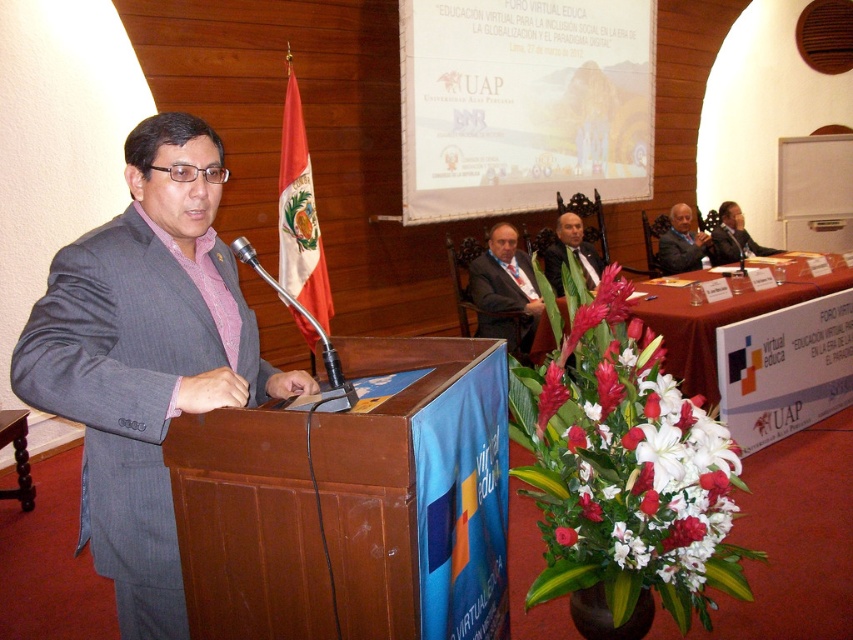
What is the location of the point with coordinates [299,216] in the image?

The point with coordinates [299,216] is located on the red fabric flag at upper left.

You are attending a formal event and see a gray pinstripe suit at left and a matte pink flower at center. Which object is positioned to the left of the other?

The gray pinstripe suit at left is positioned to the left of the matte pink flower at center.

You are organizing a charity event and need to decide which suit to choose between the gray pinstripe suit at left and the smooth black suit at right. Considering the event requires a more formal and professional look, which suit would be more appropriate based on their sizes?

The gray pinstripe suit at left has a larger size compared to the smooth black suit at right. Since the event requires a formal and professional look, the gray pinstripe suit at left would be more appropriate as it is larger and more imposing.